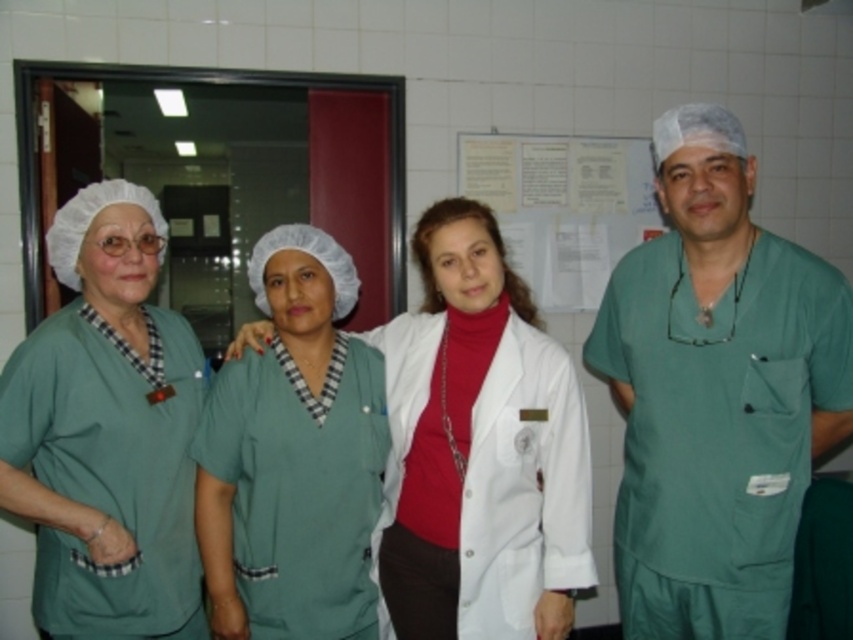
You are a medical supply delivery person who needs to place a new medical kit between the matte green scrubs at left and the green scrubs at center. The medical kit is 9 inches long. Will there be enough space between them to place the kit?

The matte green scrubs at left and the green scrubs at center are 8.54 inches apart. Since the medical kit is 9 inches long, it will not fit between them as the space is slightly smaller than the kit.

You are a medical student observing the scene. You notice the green scrubs at center and the white paper at upper center. Which object takes up more space in the image?

The green scrubs at center takes up more space in the image as it has a larger size compared to the white paper at upper center.

In the scene shown: You are a medical student trying to identify which healthcare worker has a thinner scrubs. You see the matte green scrubs at left and the green scrubs at center. Which one is thinner?

The matte green scrubs at left is thinner than the green scrubs at center.